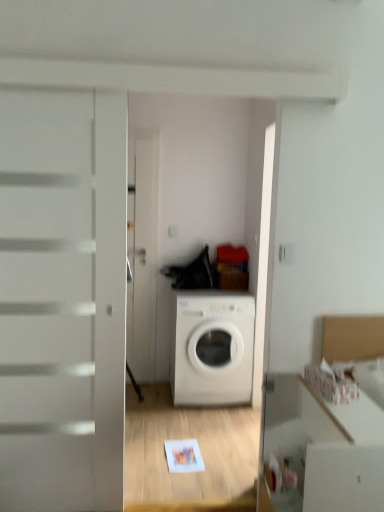
Question: Is white glossy washing machine at center not inside white glossy cabinet at lower right?

Choices:
 (A) no
 (B) yes

Answer: (B)

Question: Considering the relative sizes of white glossy washing machine at center and white glossy cabinet at lower right in the image provided, is white glossy washing machine at center shorter than white glossy cabinet at lower right?

Choices:
 (A) no
 (B) yes

Answer: (A)

Question: Is white glossy washing machine at center facing towards white glossy cabinet at lower right?

Choices:
 (A) yes
 (B) no

Answer: (A)

Question: From a real-world perspective, is white glossy washing machine at center on white glossy cabinet at lower right?

Choices:
 (A) no
 (B) yes

Answer: (A)

Question: Considering the relative sizes of white glossy washing machine at center and white glossy cabinet at lower right in the image provided, is white glossy washing machine at center taller than white glossy cabinet at lower right?

Choices:
 (A) no
 (B) yes

Answer: (B)

Question: Does white glossy washing machine at center appear on the right side of white glossy cabinet at lower right?

Choices:
 (A) yes
 (B) no

Answer: (B)

Question: Would you consider white glossy cabinet at lower right to be distant from white glossy washing machine at center?

Choices:
 (A) no
 (B) yes

Answer: (B)

Question: From the image's perspective, would you say white glossy cabinet at lower right is shown under white glossy washing machine at center?

Choices:
 (A) no
 (B) yes

Answer: (B)

Question: Does white glossy cabinet at lower right turn towards white glossy washing machine at center?

Choices:
 (A) yes
 (B) no

Answer: (B)

Question: From a real-world perspective, is white glossy cabinet at lower right positioned under white glossy washing machine at center based on gravity?

Choices:
 (A) yes
 (B) no

Answer: (B)

Question: Is white glossy cabinet at lower right smaller than white glossy washing machine at center?

Choices:
 (A) no
 (B) yes

Answer: (B)

Question: Is white glossy washing machine at center located within white glossy cabinet at lower right?

Choices:
 (A) no
 (B) yes

Answer: (A)

Question: Considering the positions of white glossy cabinet at lower right and white glossy washing machine at center in the image, is white glossy cabinet at lower right bigger or smaller than white glossy washing machine at center?

Choices:
 (A) big
 (B) small

Answer: (B)